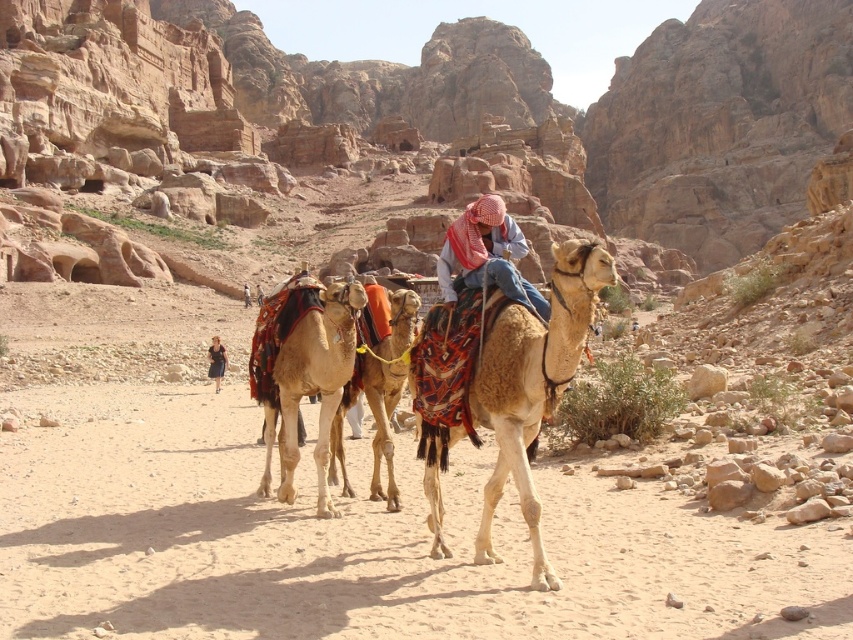
Which is behind, point (212, 376) or point (262, 296)?

Positioned behind is point (262, 296).

What do you see at coordinates (216, 362) in the screenshot?
I see `dark blue dress at lower left` at bounding box center [216, 362].

Describe the element at coordinates (216, 362) in the screenshot. I see `dark blue dress at lower left` at that location.

The height and width of the screenshot is (640, 853). I want to click on dark blue dress at lower left, so click(x=216, y=362).

The width and height of the screenshot is (853, 640). Describe the element at coordinates (532, 385) in the screenshot. I see `brown textured camel at center` at that location.

Can you confirm if brown textured camel at center is bigger than light brown textured camel at center?

Indeed, brown textured camel at center has a larger size compared to light brown textured camel at center.

Who is more distant from viewer, (584, 298) or (260, 356)?

Point (260, 356)

Image resolution: width=853 pixels, height=640 pixels. In order to click on brown textured camel at center in this screenshot , I will do `click(532, 385)`.

Who is more forward, (561, 392) or (244, 298)?

Point (561, 392) is in front.

Where is `brown textured camel at center`? The image size is (853, 640). brown textured camel at center is located at coordinates (532, 385).